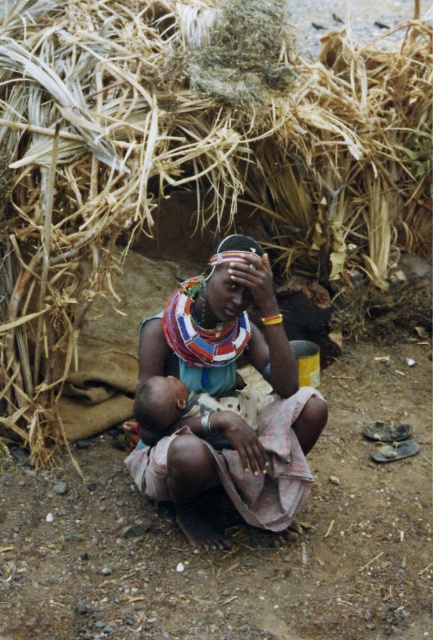
Question: Estimate the real-world distances between objects in this image. Which object is farther from the brown straw at upper center?

Choices:
 (A) multicolored fabric at center
 (B) light brown skin child at center

Answer: (B)

Question: Considering the relative positions of brown straw at upper center and multicolored fabric at center in the image provided, where is brown straw at upper center located with respect to multicolored fabric at center?

Choices:
 (A) right
 (B) left

Answer: (B)

Question: Which object is positioned farthest from the multicolored fabric at center?

Choices:
 (A) light brown skin child at center
 (B) brown straw at upper center

Answer: (B)

Question: Which of the following is the closest to the observer?

Choices:
 (A) (261, 202)
 (B) (278, 515)
 (C) (210, 426)

Answer: (C)

Question: Is brown straw at upper center smaller than light brown skin child at center?

Choices:
 (A) no
 (B) yes

Answer: (A)

Question: Is brown straw at upper center bigger than light brown skin child at center?

Choices:
 (A) yes
 (B) no

Answer: (A)